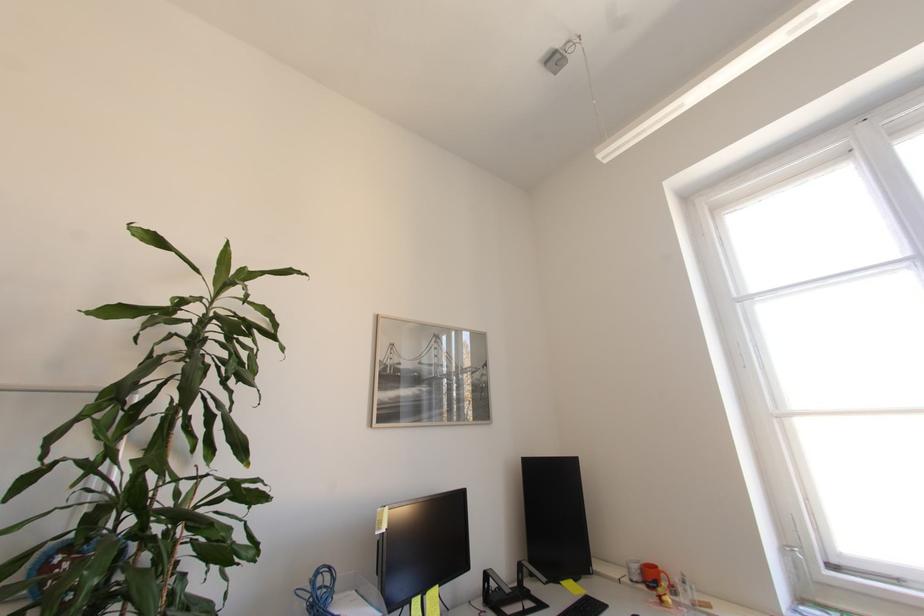
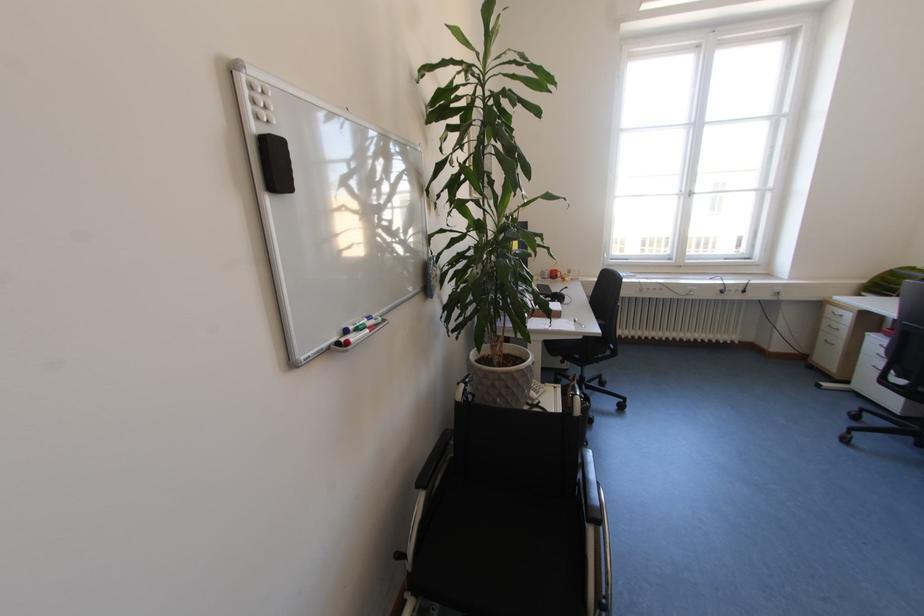
The point at (x=642, y=581) is marked in the first image. Where is the corresponding point in the second image?

(553, 278)